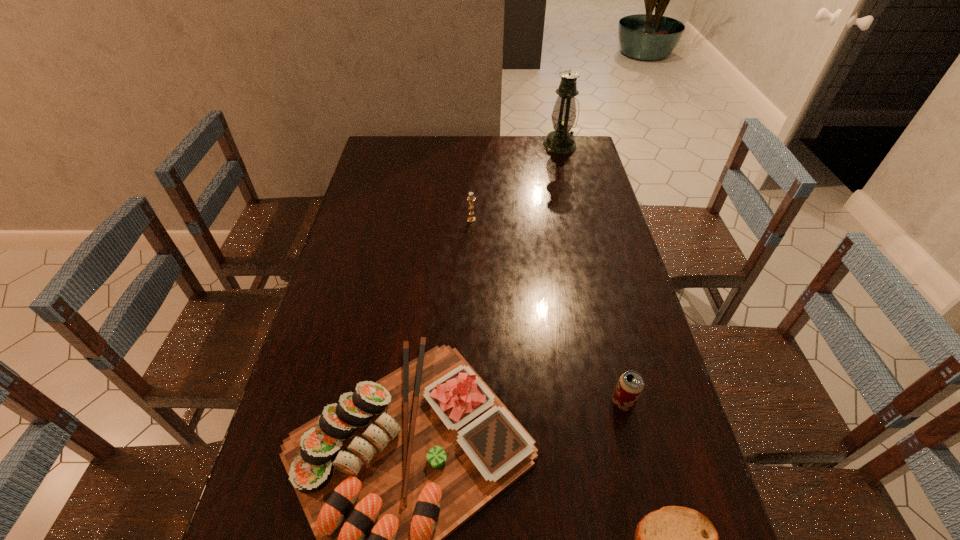
Image resolution: width=960 pixels, height=540 pixels. I want to click on free location that satisfies the following two spatial constraints: 1. on the front side of the beer can; 2. on the right side of the candle holder, so click(468, 403).